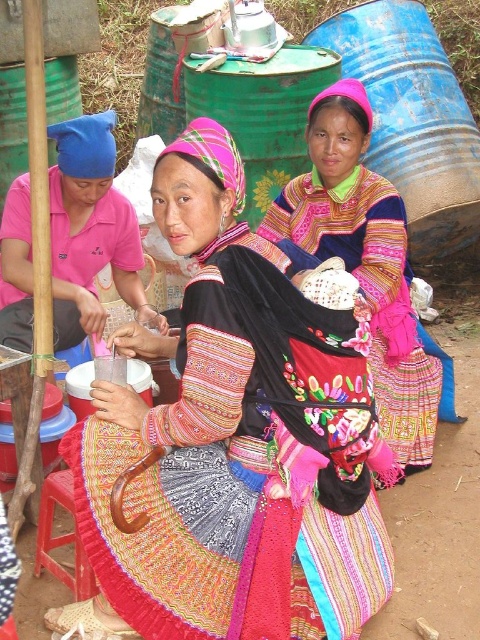
You are a photographer planning to take a group photo of the velvet embroidered dress at center and the wooden stool at lower left. If you want to ensure both subjects are fully visible in the frame, which one should you position closer to the camera to avoid cropping?

The velvet embroidered dress at center should be positioned closer to the camera because its width is larger than the wooden stool at lower left, ensuring it fits within the frame without cropping.

From the picture: You are a photographer setting up a shoot in the rural scene. You have a velvet embroidered dress at center and a wooden stool at lower left. Which object is covering the other?

The velvet embroidered dress at center is positioned over the wooden stool at lower left, so the dress is covering the stool.

Based on the scene description, where is the velvet embroidered dress at center located in terms of coordinates?

The velvet embroidered dress at center is located at point (242, 467).